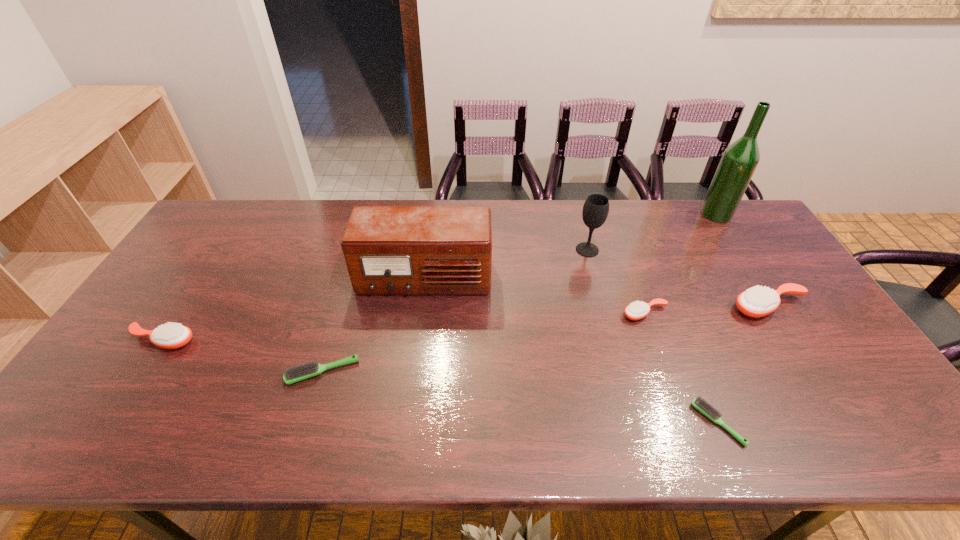
Identify the location of green alcohol. (739, 161).

What are the coordinates of `the farthest object` in the screenshot? It's located at (739, 161).

Find the location of a particular element. radio receiver is located at coordinates (388, 250).

Image resolution: width=960 pixels, height=540 pixels. I want to click on the second farthest object, so click(596, 207).

The width and height of the screenshot is (960, 540). I want to click on the fifth object from right to left, so click(x=596, y=207).

Locate an element on the screen. Image resolution: width=960 pixels, height=540 pixels. the tallest hairbrush is located at coordinates (758, 301).

In order to click on the rightmost orange hairbrush in this screenshot , I will do `click(758, 301)`.

Locate an element on the screen. the leftmost object is located at coordinates (172, 335).

Where is `the second biggest orange hairbrush`? Image resolution: width=960 pixels, height=540 pixels. the second biggest orange hairbrush is located at coordinates (172, 335).

You are a GUI agent. You are given a task and a screenshot of the screen. Output one action in this format:
    pyautogui.click(x=<x>, y=<y>)
    Task: Click on the second orange hairbrush from left to right
    
    Given the screenshot: What is the action you would take?
    pyautogui.click(x=636, y=310)